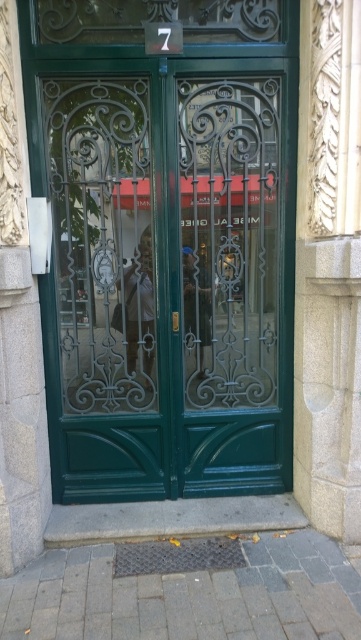
How distant is green glass screen door at center from matte white shirt at center?

green glass screen door at center is 8.21 inches away from matte white shirt at center.

Does green glass screen door at center appear under matte white shirt at center?

No.

Describe the element at coordinates (103, 289) in the screenshot. This screenshot has width=361, height=640. I see `green glass screen door at center` at that location.

I want to click on green glass screen door at center, so click(103, 289).

Is green glass screen door at center to the left of smooth leather jacket at center from the viewer's perspective?

Yes, green glass screen door at center is to the left of smooth leather jacket at center.

Is point (45, 296) behind point (202, 340)?

That is False.

This screenshot has width=361, height=640. Identify the location of green glass screen door at center. (103, 289).

Which is in front, point (203, 339) or point (140, 285)?

Point (140, 285) is in front.

Between point (245, 230) and point (148, 292), which one is positioned in front?

Point (245, 230) is in front.

Find the location of `green wrought iron screen door at center`. green wrought iron screen door at center is located at coordinates (232, 280).